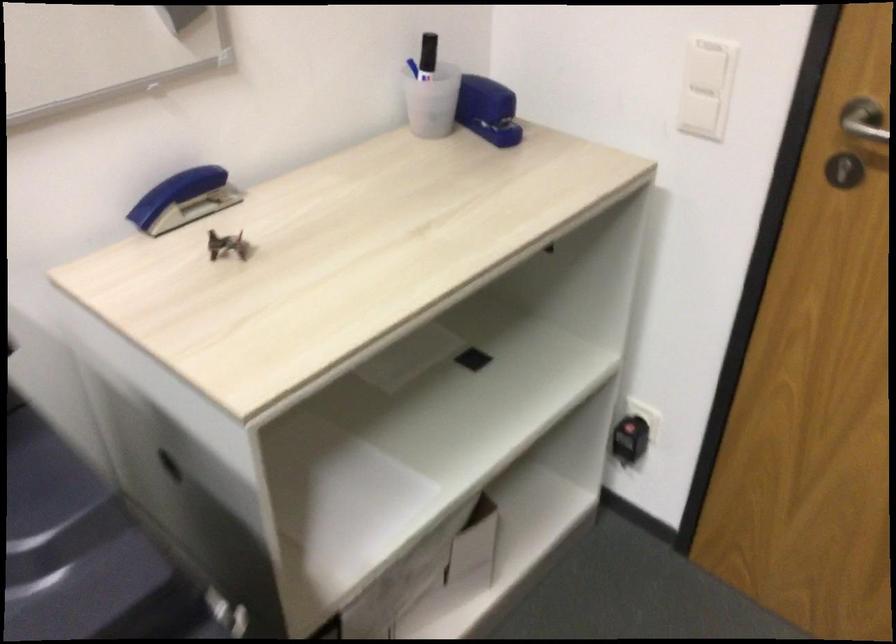
Where would you lift the binder clip? Please return your answer as a coordinate pair (x, y).

(487, 109)